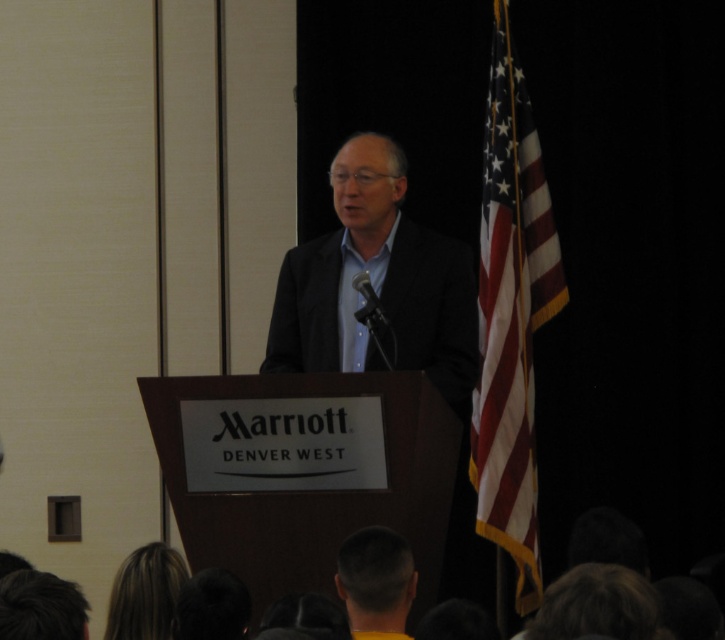
Question: Which point appears closest to the camera in this image?

Choices:
 (A) (406, 282)
 (B) (348, 580)
 (C) (592, 604)

Answer: (C)

Question: Among these objects, which one is nearest to the camera?

Choices:
 (A) dark gray suit at center
 (B) blonde hair at lower left
 (C) american flag at right

Answer: (B)

Question: Is dark brown hair at lower center to the left of dark brown hair at lower left from the viewer's perspective?

Choices:
 (A) yes
 (B) no

Answer: (B)

Question: Which point is farther to the camera?

Choices:
 (A) (343, 573)
 (B) (25, 600)

Answer: (A)

Question: Is dark brown hair at lower right bigger than dark brown hair at lower left?

Choices:
 (A) no
 (B) yes

Answer: (B)

Question: From the image, what is the correct spatial relationship of american flag at right in relation to dark brown hair at lower right?

Choices:
 (A) right
 (B) left

Answer: (A)